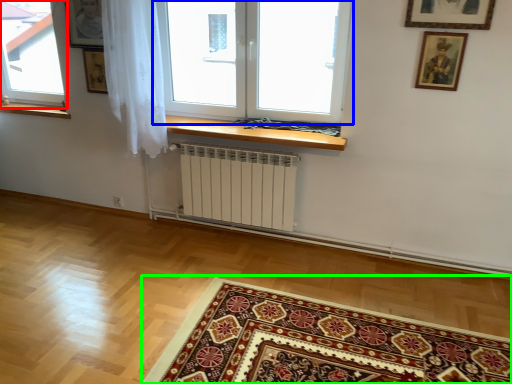
Question: Estimate the real-world distances between objects in this image. Which object is closer to window (highlighted by a red box), window (highlighted by a blue box) or mat (highlighted by a green box)?

Choices:
 (A) window
 (B) mat

Answer: (A)